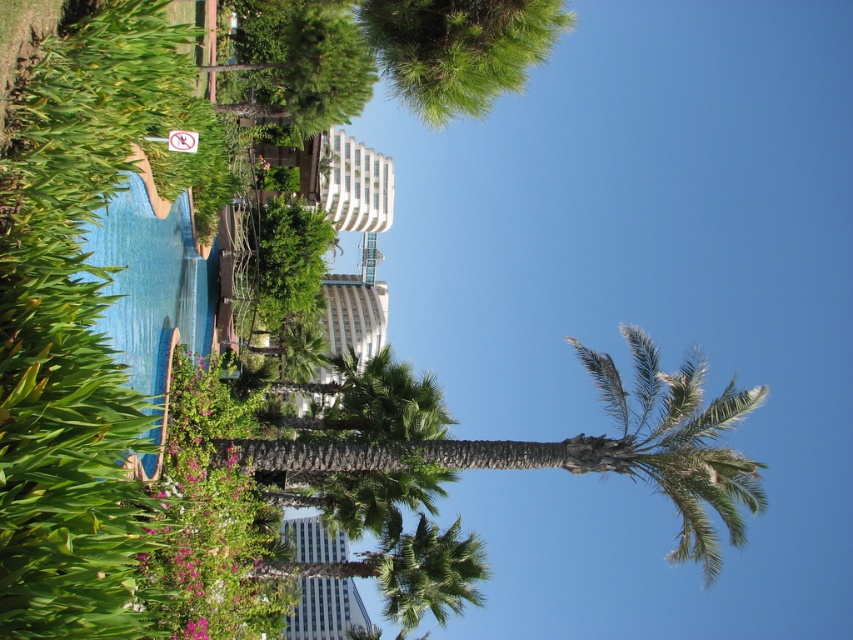
Consider the image. You are a bird flying over the garden and want to land on the tallest object between the green leafy palm tree at center and the white plastic sign at upper center. Which object should you choose?

The green leafy palm tree at center is taller than the white plastic sign at upper center, so you should choose the green leafy palm tree at center to land on.